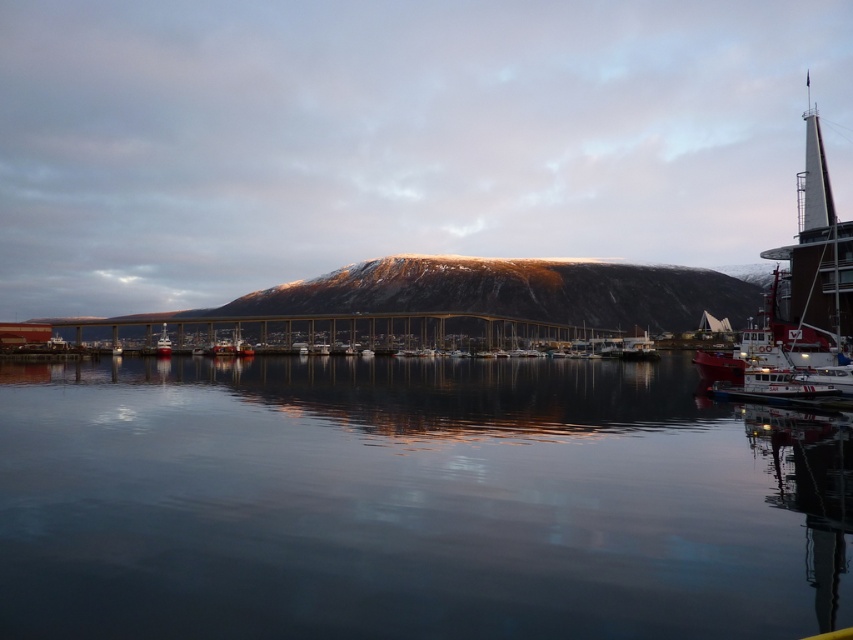
Who is more distant from viewer, (821, 216) or (165, 326)?

The point (165, 326) is behind.

Is the position of red matte boat at right less distant than that of shiny red boat at lower left?

That is True.

The height and width of the screenshot is (640, 853). Find the location of `red matte boat at right`. red matte boat at right is located at coordinates (799, 305).

Which is in front, point (276, 285) or point (799, 218)?

Point (799, 218) is in front.

Which is more to the right, sandy brown rock at center or red matte boat at right?

red matte boat at right

In order to click on sandy brown rock at center in this screenshot , I will do `click(485, 294)`.

Is the position of smooth dark water at center more distant than that of sandy brown rock at center?

No, smooth dark water at center is in front of sandy brown rock at center.

Locate an element on the screen. The image size is (853, 640). smooth dark water at center is located at coordinates (412, 502).

Where is `smooth dark water at center`? smooth dark water at center is located at coordinates (412, 502).